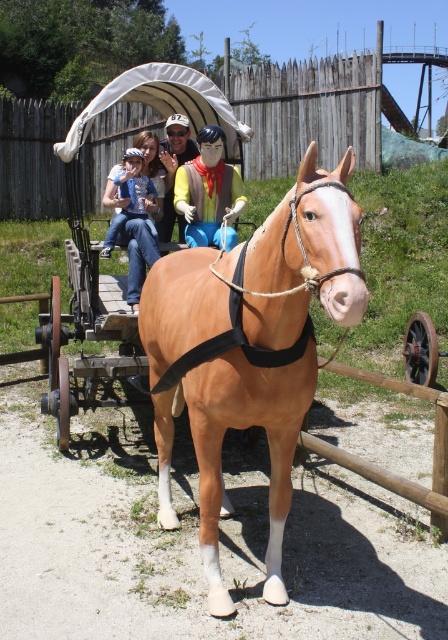
Question: Which point appears closest to the camera in this image?

Choices:
 (A) (120, 173)
 (B) (190, 413)
 (C) (215, 214)
 (D) (228, 221)

Answer: (B)

Question: Does matte yellow shirt at center have a greater width compared to yellow fabric coach at upper center?

Choices:
 (A) no
 (B) yes

Answer: (B)

Question: Can you confirm if rainbow fabric cowboy at center is positioned above yellow fabric coach at upper center?

Choices:
 (A) no
 (B) yes

Answer: (A)

Question: Considering the real-world distances, which object is farthest from the rainbow fabric cowboy at center?

Choices:
 (A) brown leather horse cart at center
 (B) matte yellow shirt at center
 (C) yellow fabric coach at upper center
 (D) light brown glossy horse at center

Answer: (D)

Question: Based on their relative distances, which object is nearer to the matte yellow shirt at center?

Choices:
 (A) brown leather horse cart at center
 (B) yellow fabric coach at upper center
 (C) light brown glossy horse at center
 (D) blue denim jeans at upper left

Answer: (B)

Question: Is matte yellow shirt at center to the left of blue denim jeans at upper left from the viewer's perspective?

Choices:
 (A) no
 (B) yes

Answer: (A)